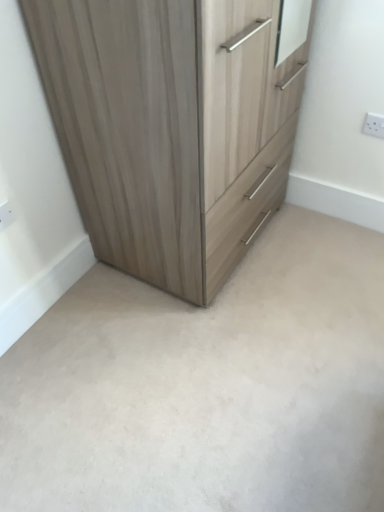
Question: Is white plastic electric outlet at lower left, which is the 1th electric outlet in left-to-right order, taller than light wood/texture chest of drawers at upper left?

Choices:
 (A) yes
 (B) no

Answer: (B)

Question: From the image's perspective, does white plastic electric outlet at lower left, which is the 1th electric outlet in left-to-right order, appear lower than light wood/texture chest of drawers at upper left?

Choices:
 (A) no
 (B) yes

Answer: (B)

Question: Can you confirm if white plastic electric outlet at lower left, positioned as the 1th electric outlet in front-to-back order, is thinner than light wood/texture chest of drawers at upper left?

Choices:
 (A) yes
 (B) no

Answer: (A)

Question: Considering the relative positions of white plastic electric outlet at lower left, acting as the 2th electric outlet starting from the top, and light wood/texture chest of drawers at upper left in the image provided, is white plastic electric outlet at lower left, acting as the 2th electric outlet starting from the top, behind light wood/texture chest of drawers at upper left?

Choices:
 (A) no
 (B) yes

Answer: (B)

Question: Can you confirm if white plastic electric outlet at lower left, which is the first electric outlet from bottom to top, is positioned to the right of light wood/texture chest of drawers at upper left?

Choices:
 (A) no
 (B) yes

Answer: (A)

Question: Is the depth of white plastic electric outlet at lower left, arranged as the 2th electric outlet when viewed from the right, less than that of light wood/texture chest of drawers at upper left?

Choices:
 (A) no
 (B) yes

Answer: (A)

Question: Is beige carpet at center completely or partially inside white plastic electric outlet at lower left, which is the 1th electric outlet in left-to-right order?

Choices:
 (A) yes
 (B) no

Answer: (B)

Question: Is white plastic electric outlet at lower left, acting as the 2th electric outlet starting from the top, positioned with its back to beige carpet at center?

Choices:
 (A) yes
 (B) no

Answer: (B)

Question: Considering the relative positions of white plastic electric outlet at lower left, which is the 1th electric outlet in left-to-right order, and beige carpet at center in the image provided, is white plastic electric outlet at lower left, which is the 1th electric outlet in left-to-right order, to the right of beige carpet at center from the viewer's perspective?

Choices:
 (A) no
 (B) yes

Answer: (A)

Question: From a real-world perspective, is white plastic electric outlet at lower left, which is the 1th electric outlet in left-to-right order, positioned over beige carpet at center based on gravity?

Choices:
 (A) no
 (B) yes

Answer: (B)

Question: From a real-world perspective, is white plastic electric outlet at lower left, arranged as the 2th electric outlet when viewed from the right, below beige carpet at center?

Choices:
 (A) yes
 (B) no

Answer: (B)

Question: Can you confirm if white plastic electric outlet at lower left, acting as the 2th electric outlet starting from the top, is bigger than beige carpet at center?

Choices:
 (A) no
 (B) yes

Answer: (A)

Question: Is white plastic electric outlet at lower left, arranged as the 2th electric outlet when viewed from the right, at the right side of white plastic electric outlet at upper right, the 1th electric outlet positioned from the top?

Choices:
 (A) yes
 (B) no

Answer: (B)